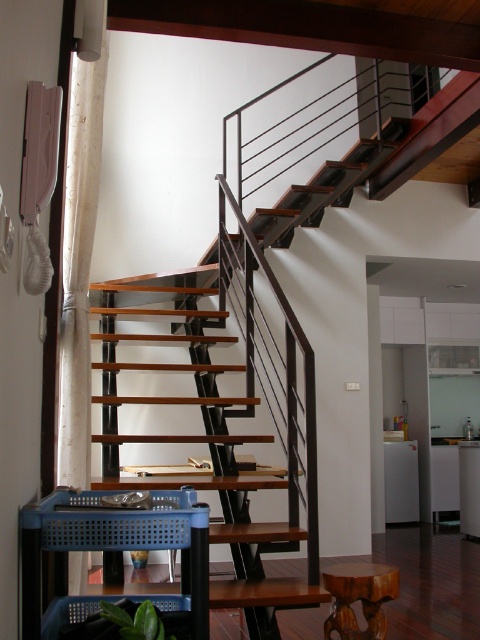
You are moving a blue plastic basket at lower left and a wooden stool at lower right into a narrow hallway. The hallway is only 1 meter wide. Based on their sizes, which object might have more difficulty fitting through the hallway?

The blue plastic basket at lower left has a larger width than the wooden stool at lower right, so it might have more difficulty fitting through the 1 meter wide hallway.

You are a delivery person standing in the entrance of the house and see the blue plastic basket at lower left and the wooden stool at lower right. You need to place a package on the nearest object to the entrance. Which object should you choose?

The blue plastic basket at lower left is 4.34 feet away from wooden stool at lower right. Since the blue plastic basket at lower left is closer to the entrance than the wooden stool at lower right, you should place the package on the blue plastic basket at lower left.

You are moving a blue plastic basket and a wooden stool into a modern living room. The room has a staircase with black metal railings. You need to place the blue plastic basket at lower left and the wooden stool at lower right. According to the scene description, where should you position the blue plastic basket relative to the wooden stool?

The blue plastic basket at lower left should be placed to the left of the wooden stool at lower right.